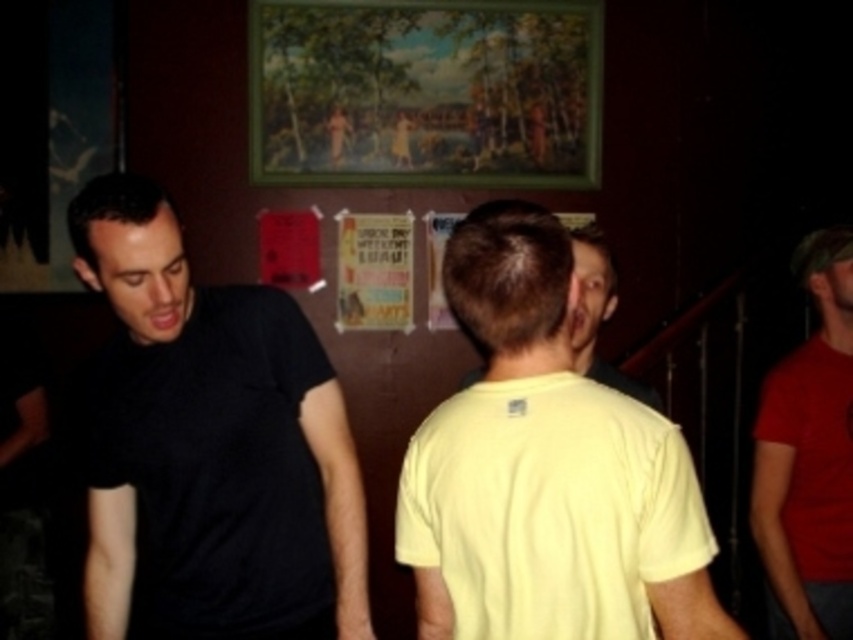
Question: Which point appears farthest from the camera in this image?

Choices:
 (A) (154, 278)
 (B) (708, 605)

Answer: (A)

Question: Which object appears closest to the camera in this image?

Choices:
 (A) black matte t-shirt at left
 (B) yellow matte shirt at center

Answer: (B)

Question: Does black matte t-shirt at left appear on the left side of yellow matte t-shirt at center?

Choices:
 (A) yes
 (B) no

Answer: (A)

Question: Is yellow matte t-shirt at center bigger than red matte t-shirt at right?

Choices:
 (A) no
 (B) yes

Answer: (A)

Question: Can you confirm if black matte t-shirt at left is thinner than yellow matte shirt at center?

Choices:
 (A) yes
 (B) no

Answer: (B)

Question: Which is farther from the black matte t-shirt at left?

Choices:
 (A) yellow matte t-shirt at center
 (B) red matte t-shirt at right

Answer: (B)